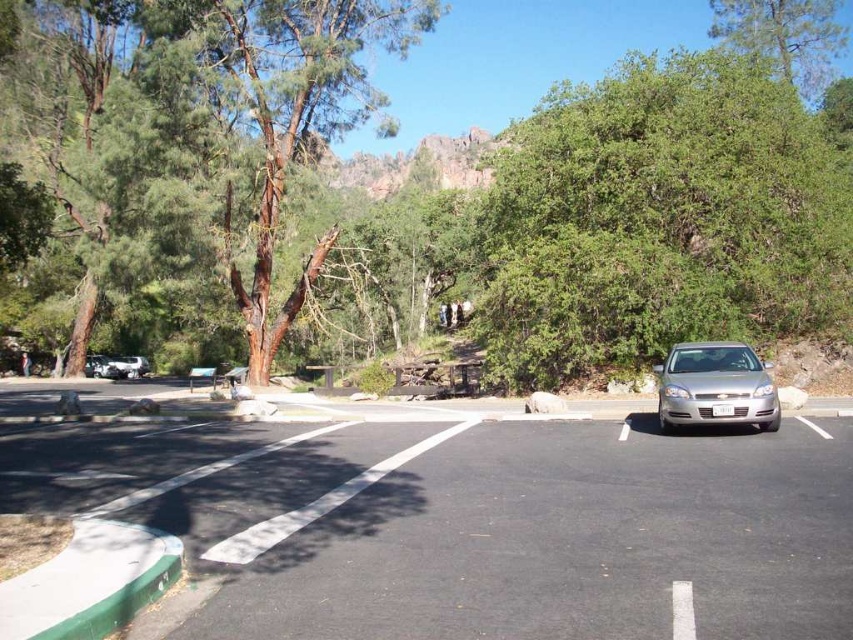
Question: Can you confirm if green leafy tree at center is bigger than satin silver sedan at right?

Choices:
 (A) yes
 (B) no

Answer: (A)

Question: Which object appears farthest from the camera in this image?

Choices:
 (A) green leafy tree at center
 (B) satin silver sedan at right
 (C) black asphalt parking lot at center
 (D) green leafy tree at upper right

Answer: (D)

Question: Can you confirm if black asphalt parking lot at center is positioned above green rough bark tree at upper left?

Choices:
 (A) no
 (B) yes

Answer: (A)

Question: Which point is farther from the camera taking this photo?

Choices:
 (A) (740, 0)
 (B) (735, 506)

Answer: (A)

Question: Observing the image, what is the correct spatial positioning of black asphalt parking lot at center in reference to satin silver sedan at right?

Choices:
 (A) below
 (B) above

Answer: (A)

Question: Which point is closer to the camera taking this photo?

Choices:
 (A) (718, 568)
 (B) (677, 410)
 (C) (639, 332)
 (D) (827, 54)

Answer: (A)